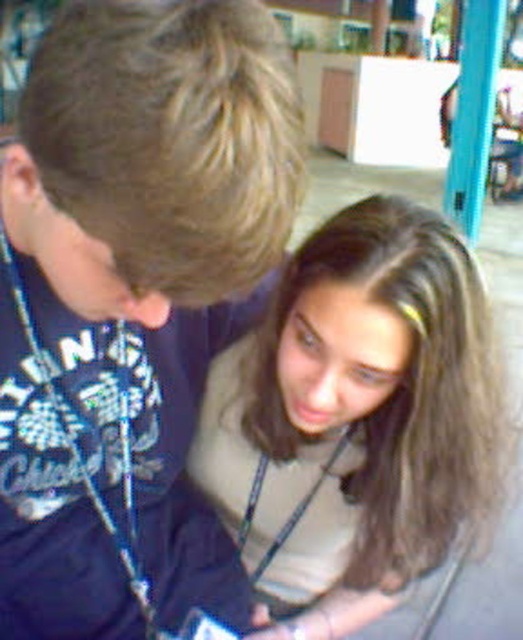
Question: Among these points, which one is nearest to the camera?

Choices:
 (A) (210, 26)
 (B) (274, 513)

Answer: (A)

Question: Which point is farther to the camera?

Choices:
 (A) dark blue t-shirt at upper left
 (B) brown hair at center

Answer: (B)

Question: Does dark blue t-shirt at upper left appear on the left side of brown hair at center?

Choices:
 (A) yes
 (B) no

Answer: (A)

Question: Which point is farther from the camera taking this photo?

Choices:
 (A) (238, 396)
 (B) (109, 513)

Answer: (A)

Question: Does dark blue t-shirt at upper left appear under brown hair at center?

Choices:
 (A) yes
 (B) no

Answer: (B)

Question: Is dark blue t-shirt at upper left bigger than brown hair at center?

Choices:
 (A) no
 (B) yes

Answer: (A)